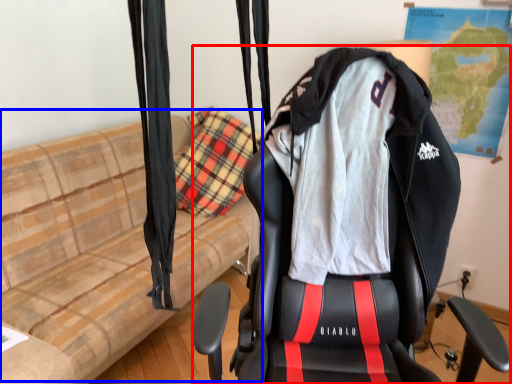
Question: Which point is closer to the camera, chair (highlighted by a red box) or couch (highlighted by a blue box)?

Choices:
 (A) chair
 (B) couch

Answer: (A)